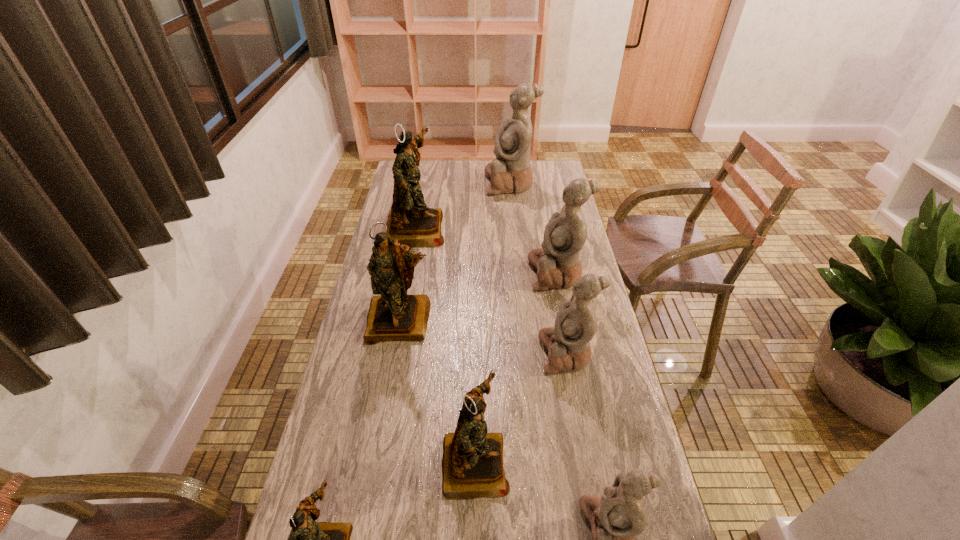
Identify the location of free space that is in between the farthest white figurine and the sixth nearest object. The width and height of the screenshot is (960, 540). (534, 228).

This screenshot has width=960, height=540. I want to click on object identified as the second closest to the third biggest white figurine, so click(x=472, y=463).

This screenshot has width=960, height=540. Identify the location of object that is the fourth closest to the second nearest white figurine. [616, 517].

Point out which figurine is positioned as the seventh nearest to the second smallest gold figurine. Please provide its 2D coordinates. Your answer should be formatted as a tuple, i.e. [(x, y)], where the tuple contains the x and y coordinates of a point satisfying the conditions above.

[(511, 171)]

Where is `the fourth closest figurine to the smallest white figurine`? the fourth closest figurine to the smallest white figurine is located at coordinates (393, 315).

Where is `white figurine that is the third nearest to the nearest white figurine`? This screenshot has width=960, height=540. white figurine that is the third nearest to the nearest white figurine is located at coordinates (511, 171).

Choose which white figurine is the third nearest neighbor to the farthest gold figurine. Please provide its 2D coordinates. Your answer should be formatted as a tuple, i.e. [(x, y)], where the tuple contains the x and y coordinates of a point satisfying the conditions above.

[(568, 343)]

Find the location of a particular element. the closest gold figurine relative to the third smallest gold figurine is located at coordinates (410, 221).

Where is `the second closest gold figurine to the second smallest white figurine`? the second closest gold figurine to the second smallest white figurine is located at coordinates (393, 315).